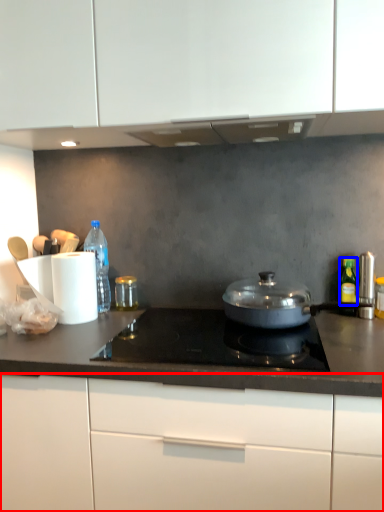
Question: Among these objects, which one is farthest to the camera, cabinetry (highlighted by a red box) or bottle (highlighted by a blue box)?

Choices:
 (A) cabinetry
 (B) bottle

Answer: (B)